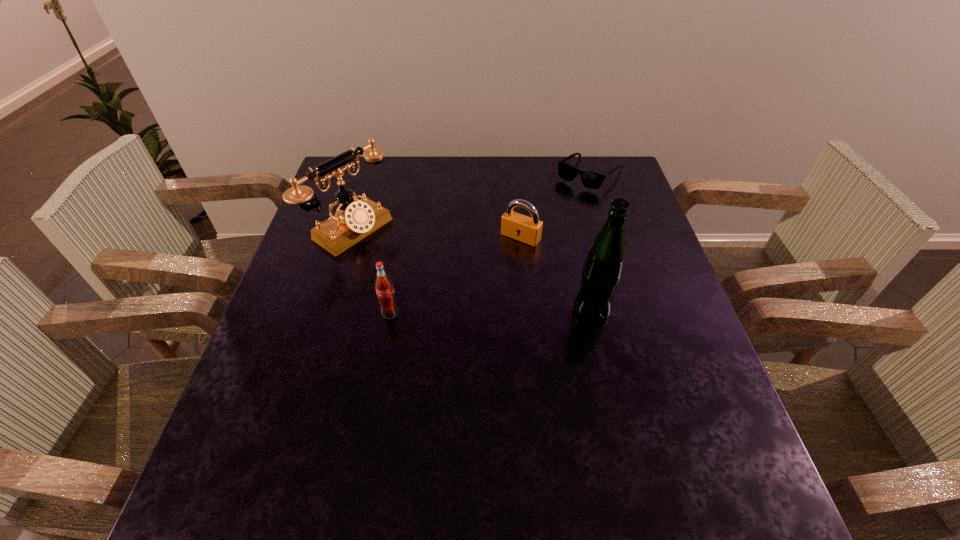
Where is `object that is at the far edge`? object that is at the far edge is located at coordinates pyautogui.click(x=592, y=180).

This screenshot has height=540, width=960. Identify the location of object that is positioned at the left edge. (354, 220).

Identify the location of object positioned at the right edge. This screenshot has height=540, width=960. click(592, 180).

I want to click on object at the far right corner, so click(x=592, y=180).

Where is `vacant space at the far edge of the desktop`? Image resolution: width=960 pixels, height=540 pixels. vacant space at the far edge of the desktop is located at coordinates (414, 164).

The height and width of the screenshot is (540, 960). I want to click on blank area at the near edge, so click(580, 412).

This screenshot has height=540, width=960. In order to click on vacant space at the left edge of the desktop in this screenshot , I will do `click(280, 355)`.

This screenshot has height=540, width=960. In the image, there is a desktop. Identify the location of vacant space at the right edge. pyautogui.click(x=652, y=377).

Find the location of `vacant space at the far right corner of the desktop`. vacant space at the far right corner of the desktop is located at coordinates (600, 169).

What are the coordinates of `free spot between the fourth tallest object and the sunglasses` in the screenshot? It's located at (555, 205).